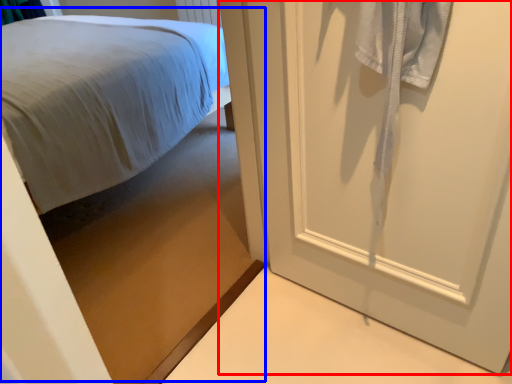
Question: Which object appears farthest to the camera in this image, door (highlighted by a red box) or bed (highlighted by a blue box)?

Choices:
 (A) door
 (B) bed

Answer: (A)